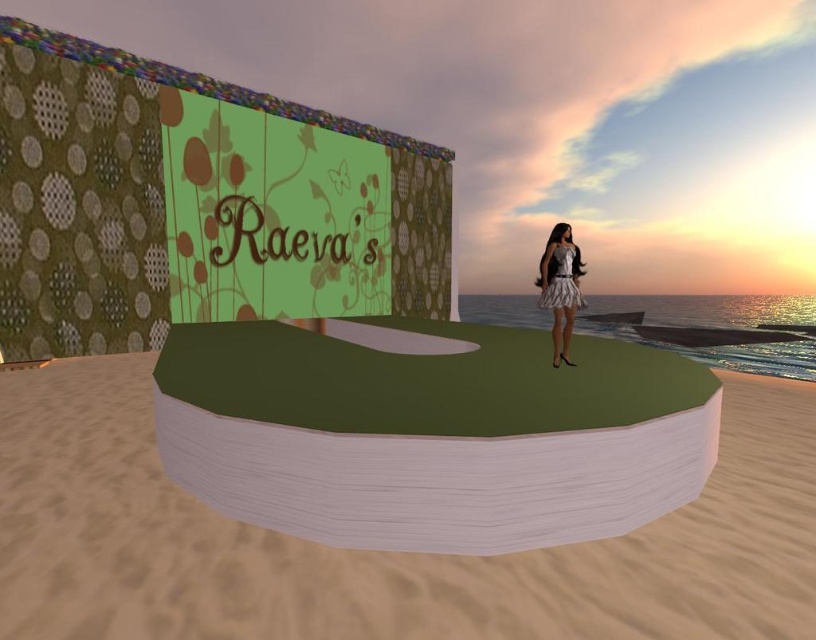
You are a golfer standing on the green wood golf course at center and want to hit the ball towards the green matte sand at center. Which direction should you aim your shot?

The green matte sand at center is below the green wood golf course at center, so you should aim your shot downward towards the green matte sand at center.

You are standing on the beach and want to place a small flag on the highest point between the green matte sand at center and the green wood golf course at center. Which object should you choose?

The green wood golf course at center is taller than the green matte sand at center, so you should place the flag on the green wood golf course at center.

Based on the photo, you are an artist planning to paint this beach scene. You want to ensure the green matte sand at center and the white satin dress at center are proportionally accurate. Which object should you make smaller in your painting?

The green matte sand at center should be made smaller in the painting because it occupies less space than the white satin dress at center according to the description.